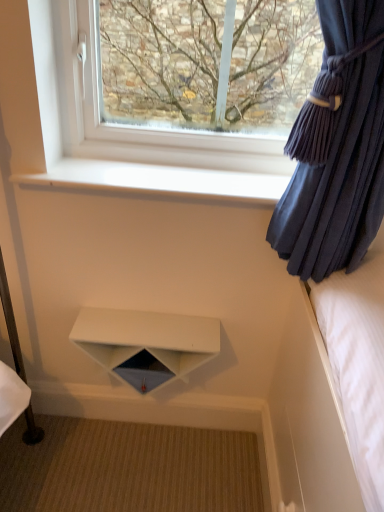
Question: Relative to velvet dark blue curtain at right, is white matte shelf at center in front or behind?

Choices:
 (A) front
 (B) behind

Answer: (B)

Question: Considering the relative positions of white matte shelf at center and velvet dark blue curtain at right in the image provided, is white matte shelf at center to the left or to the right of velvet dark blue curtain at right?

Choices:
 (A) left
 (B) right

Answer: (A)

Question: Which is nearer to the velvet dark blue curtain at right?

Choices:
 (A) white matte shelf at center
 (B) transparent glass window at upper center
 (C) white smooth window sill at upper center

Answer: (C)

Question: Estimate the real-world distances between objects in this image. Which object is closer to the white smooth window sill at upper center?

Choices:
 (A) transparent glass window at upper center
 (B) white matte shelf at center
 (C) velvet dark blue curtain at right

Answer: (A)